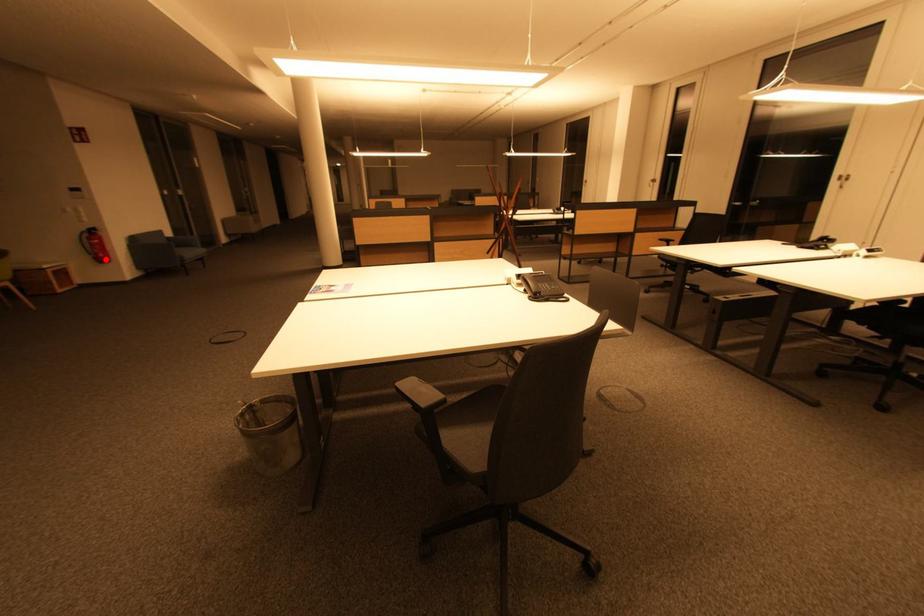
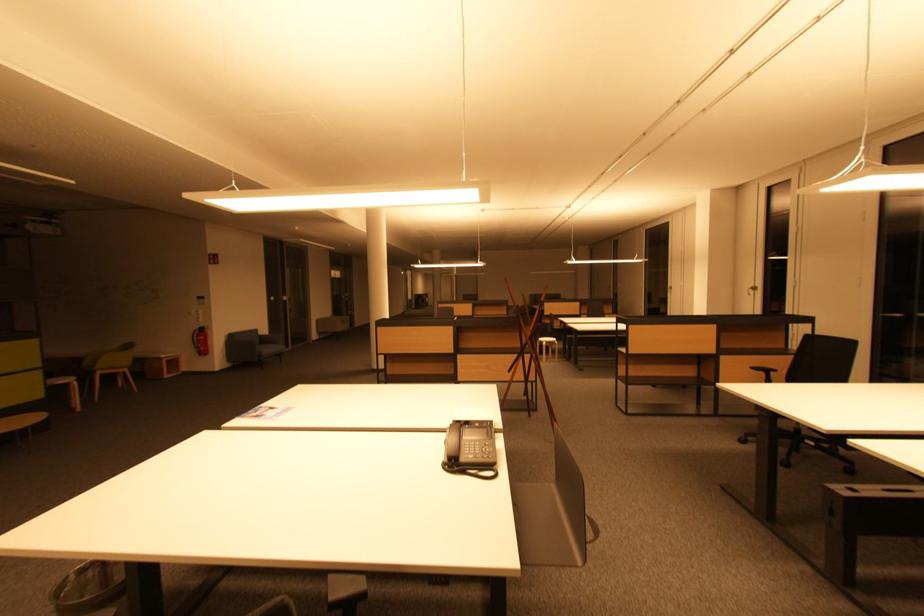
Locate, in the second image, the point that corresponds to the highlighted location in the first image.

(207, 353)